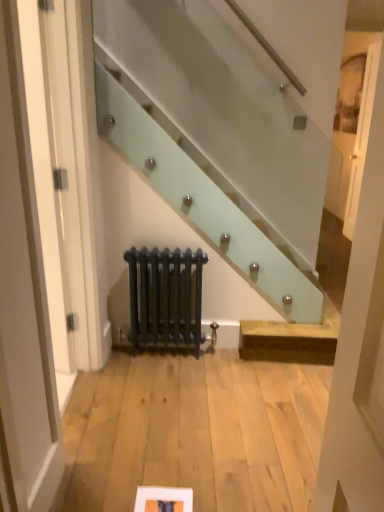
Question: From the image's perspective, would you say matte white picture frame at lower center is shown under white glossy door at upper right?

Choices:
 (A) no
 (B) yes

Answer: (B)

Question: From a real-world perspective, is matte white picture frame at lower center on top of white glossy door at upper right?

Choices:
 (A) yes
 (B) no

Answer: (B)

Question: Is matte white picture frame at lower center taller than white glossy door at upper right?

Choices:
 (A) no
 (B) yes

Answer: (A)

Question: Is matte white picture frame at lower center far from white glossy door at upper right?

Choices:
 (A) no
 (B) yes

Answer: (B)

Question: From the image's perspective, does matte white picture frame at lower center appear higher than white glossy door at upper right?

Choices:
 (A) yes
 (B) no

Answer: (B)

Question: Considering the relative positions of matte white picture frame at lower center and white glossy door at upper right in the image provided, is matte white picture frame at lower center to the right of white glossy door at upper right from the viewer's perspective?

Choices:
 (A) yes
 (B) no

Answer: (B)

Question: From the image's perspective, is matte black radiator at center located above matte white picture frame at lower center?

Choices:
 (A) no
 (B) yes

Answer: (B)

Question: Considering the relative sizes of matte black radiator at center and matte white picture frame at lower center in the image provided, is matte black radiator at center smaller than matte white picture frame at lower center?

Choices:
 (A) no
 (B) yes

Answer: (A)

Question: From a real-world perspective, is matte black radiator at center positioned under matte white picture frame at lower center based on gravity?

Choices:
 (A) no
 (B) yes

Answer: (A)

Question: Does matte black radiator at center turn towards matte white picture frame at lower center?

Choices:
 (A) yes
 (B) no

Answer: (A)

Question: Is matte black radiator at center looking in the opposite direction of matte white picture frame at lower center?

Choices:
 (A) no
 (B) yes

Answer: (A)

Question: Is matte black radiator at center thinner than matte white picture frame at lower center?

Choices:
 (A) no
 (B) yes

Answer: (B)

Question: Does matte black radiator at center come in front of white glossy door at upper right?

Choices:
 (A) no
 (B) yes

Answer: (B)